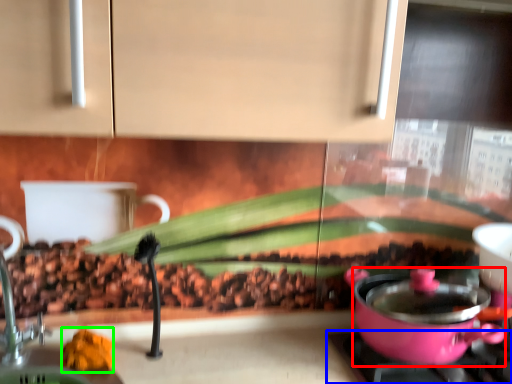
Question: Which object is the closest to the kitchen appliance (highlighted by a red box)? Choose among these: gas stove (highlighted by a blue box) or food (highlighted by a green box).

Choices:
 (A) gas stove
 (B) food

Answer: (A)